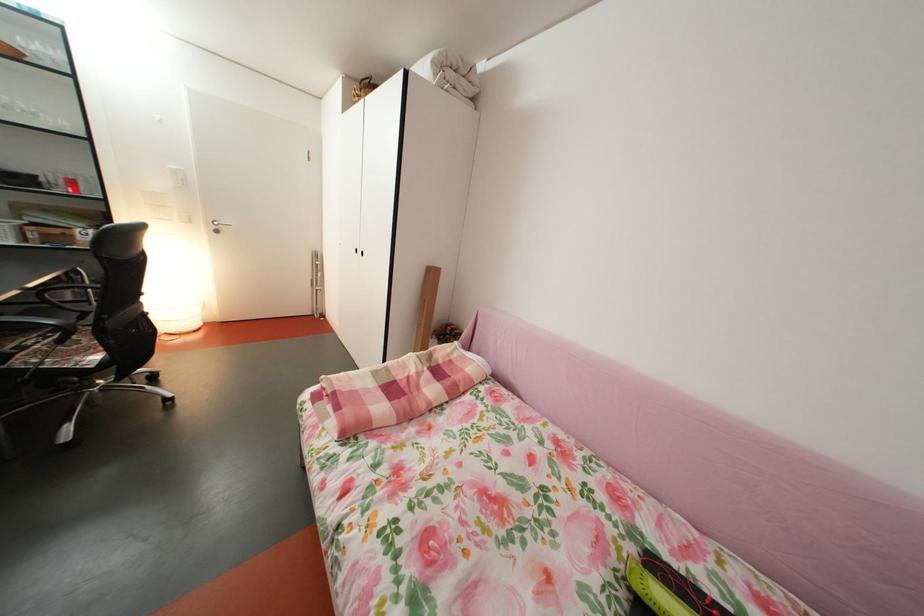
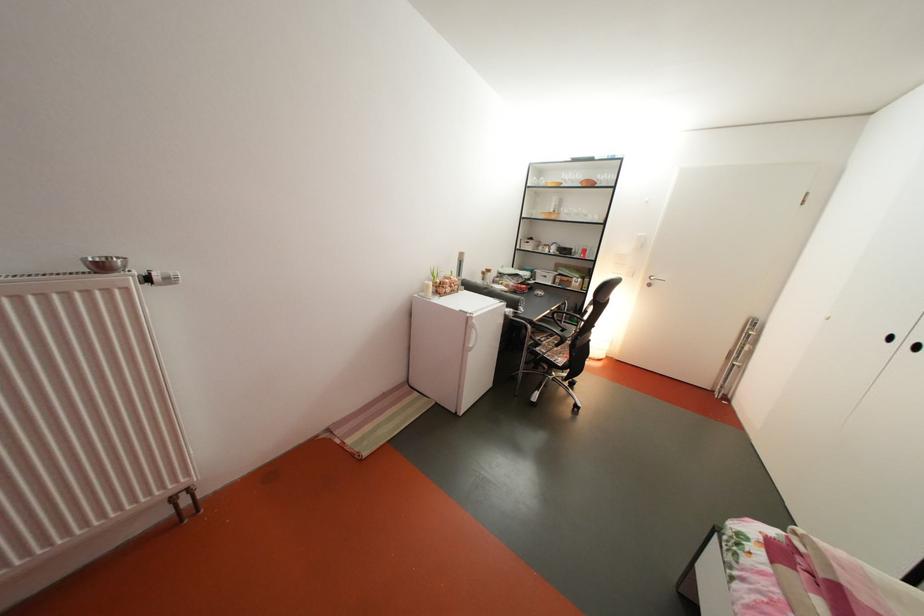
Question: I am providing you with two images of the same scene from different viewpoints. Given a red point in image1, look at the same physical point in image2. Is it:

Choices:
 (A) Closer to the viewpoint
 (B) Farther from the viewpoint

Answer: (A)